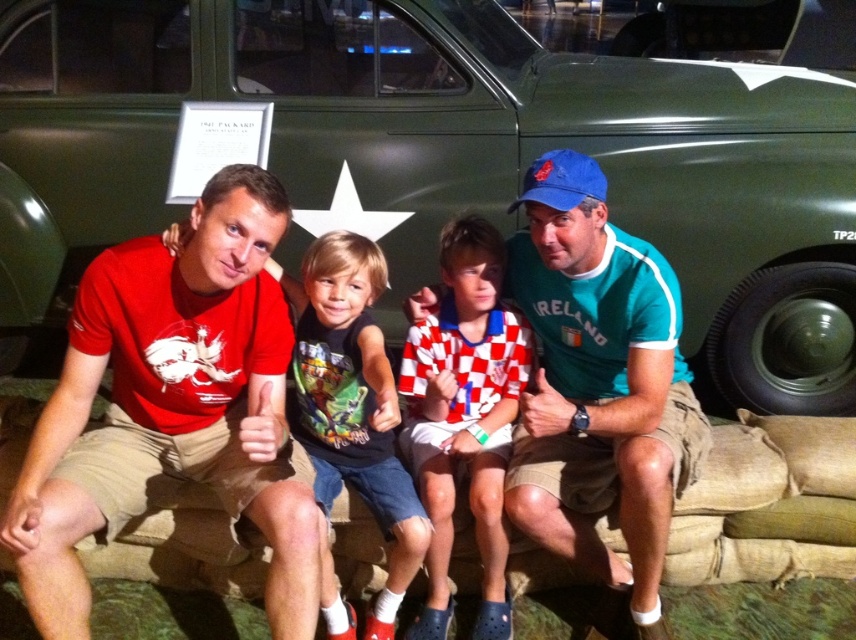
Is point (639, 525) positioned after point (68, 440)?

Yes, point (639, 525) is farther from viewer.

Between matte red t-shirt at center and matte red t-shirt at left, which one has more height?

matte red t-shirt at left

Is point (66, 449) less distant than point (288, 611)?

No.

Find the location of a particular element. This screenshot has height=640, width=856. matte red t-shirt at center is located at coordinates (153, 378).

Which of these two, green matte car at upper center or red and white checkered shirt at center, stands shorter?

With less height is red and white checkered shirt at center.

Between green matte car at upper center and red and white checkered shirt at center, which one is positioned lower?

red and white checkered shirt at center is below.

Between point (734, 157) and point (424, 412), which one is positioned in front?

Point (424, 412)

The height and width of the screenshot is (640, 856). I want to click on green matte car at upper center, so click(x=447, y=157).

Between matte red t-shirt at left and teal fabric shirt at center, which one is positioned lower?

matte red t-shirt at left

Is matte red t-shirt at left bigger than teal fabric shirt at center?

Actually, matte red t-shirt at left might be smaller than teal fabric shirt at center.

Is point (247, 445) more distant than point (541, 168)?

That is False.

I want to click on matte red t-shirt at left, so click(x=175, y=400).